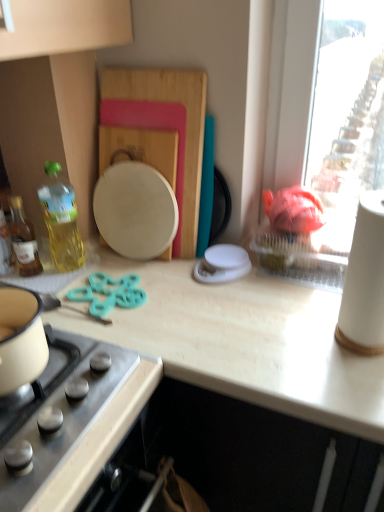
Question: Looking at their shapes, would you say teal plastic scissors at center is wider or thinner than translucent yellow bottle at left, the 2th bottle positioned from the right?

Choices:
 (A) thin
 (B) wide

Answer: (B)

Question: From a real-world perspective, is teal plastic scissors at center physically located above or below translucent yellow bottle at left, acting as the 1th bottle starting from the left?

Choices:
 (A) above
 (B) below

Answer: (B)

Question: Considering the real-world distances, which object is farthest from the stainless steel gas stove at lower left?

Choices:
 (A) teal plastic scissors at center
 (B) translucent yellow bottle at left, the 2th bottle positioned from the right
 (C) light wood countertop at center
 (D) white paper towel at right
 (E) translucent yellow bottle at left, the 2th bottle viewed from the left

Answer: (D)

Question: Considering the real-world distances, which object is closest to the translucent yellow bottle at left, the 1th bottle viewed from the right?

Choices:
 (A) white paper towel at right
 (B) translucent yellow bottle at left, the 2th bottle positioned from the right
 (C) stainless steel gas stove at lower left
 (D) teal plastic scissors at center
 (E) light wood countertop at center

Answer: (B)